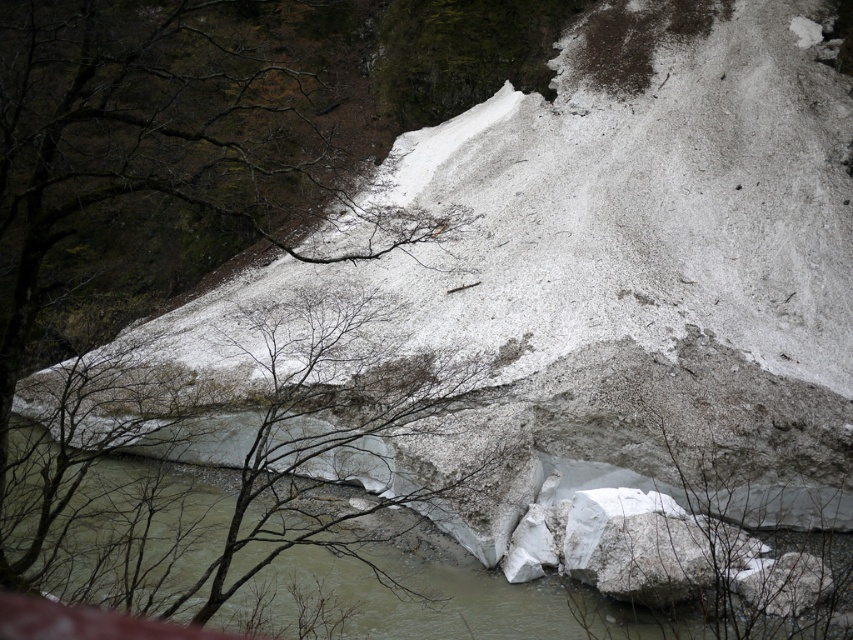
Is point (125, 586) positioned before point (570, 556)?

That is True.

Is white ice at center to the left of white snow-covered rock at lower right from the viewer's perspective?

Indeed, white ice at center is positioned on the left side of white snow-covered rock at lower right.

Find the location of `white ice at center`. white ice at center is located at coordinates (380, 589).

Is bare branches at center to the left of white ice at center from the viewer's perspective?

Indeed, bare branches at center is positioned on the left side of white ice at center.

Does bare branches at center lie behind white ice at center?

Yes, bare branches at center is behind white ice at center.

Find the location of a particular element. The image size is (853, 640). bare branches at center is located at coordinates (242, 449).

Can you confirm if bare branches at center is positioned below white snow-covered rock at lower right?

No, bare branches at center is not below white snow-covered rock at lower right.

Image resolution: width=853 pixels, height=640 pixels. What do you see at coordinates (242, 449) in the screenshot? I see `bare branches at center` at bounding box center [242, 449].

Locate an element on the screen. bare branches at center is located at coordinates (242, 449).